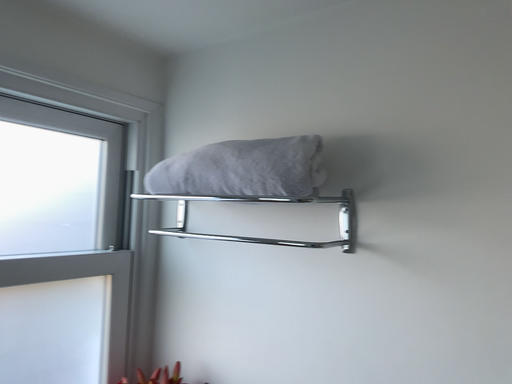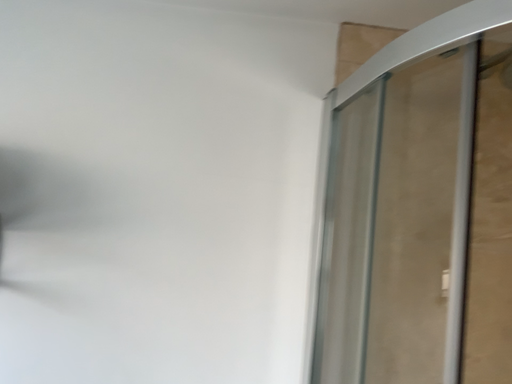
Question: How did the camera likely rotate when shooting the video?

Choices:
 (A) rotated right
 (B) rotated left

Answer: (A)